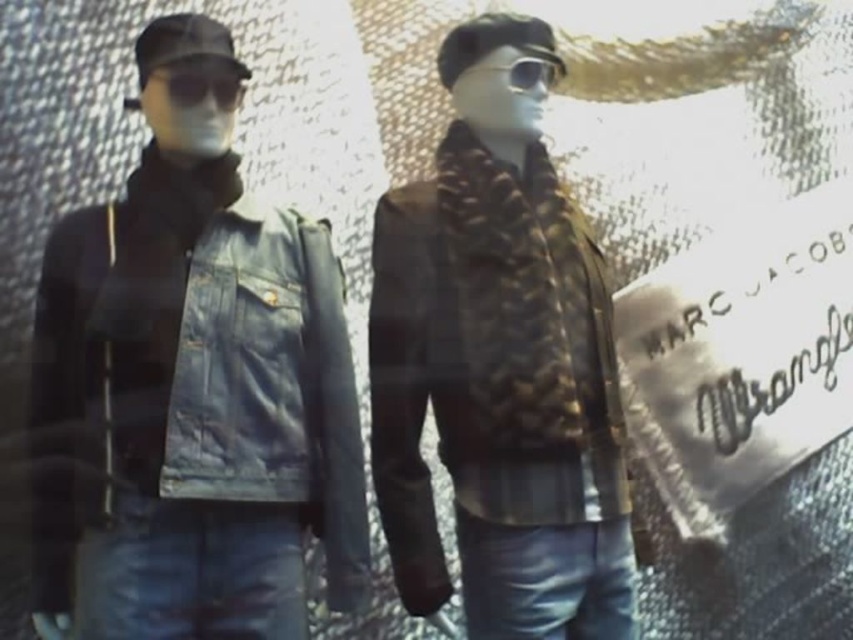
Locate an element on the screen. leather jacket at center is located at coordinates (498, 369).

Can you confirm if leather jacket at center is smaller than leather jacket at left?

Incorrect, leather jacket at center is not smaller in size than leather jacket at left.

Is point (379, 365) behind point (134, 307)?

Yes.

I want to click on leather jacket at center, so click(x=498, y=369).

Who is more distant from viewer, (328, 540) or (152, 99)?

Point (152, 99)

Which is in front, point (68, 486) or point (140, 99)?

Point (68, 486) is more forward.

Locate an element on the screen. The width and height of the screenshot is (853, 640). leather jacket at left is located at coordinates (189, 369).

Which is more to the left, leather jacket at center or matte black goggles at left?

matte black goggles at left

Can you confirm if leather jacket at center is positioned to the right of matte black goggles at left?

Correct, you'll find leather jacket at center to the right of matte black goggles at left.

The width and height of the screenshot is (853, 640). In order to click on leather jacket at center in this screenshot , I will do `click(498, 369)`.